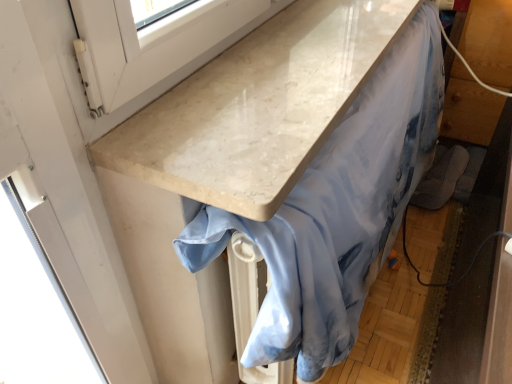
Identify the location of vacant space situated above white marble countertop at upper center (from a real-world perspective). (308, 53).